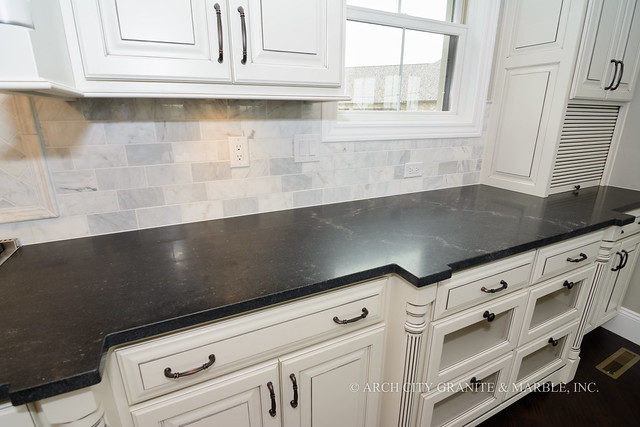
I want to click on light gray wall, so click(148, 159).